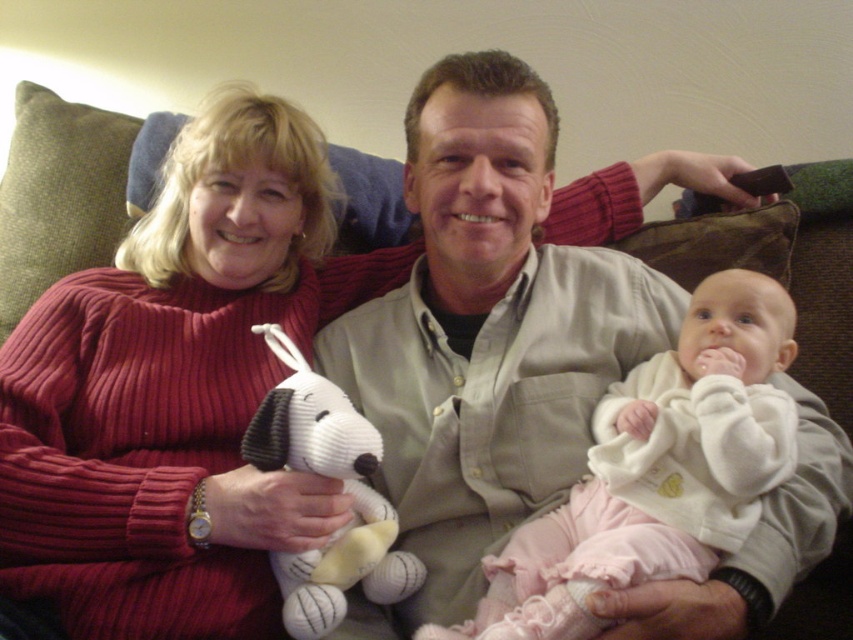
Question: Which point appears closest to the camera in this image?

Choices:
 (A) (368, 426)
 (B) (544, 371)

Answer: (A)

Question: Can you confirm if matte khaki shirt at center is positioned below white fleece jacket at center?

Choices:
 (A) yes
 (B) no

Answer: (B)

Question: Which object appears closest to the camera in this image?

Choices:
 (A) matte khaki shirt at center
 (B) white knitted dog at center
 (C) white fleece jacket at center

Answer: (A)

Question: Is matte khaki shirt at center positioned in front of white knitted dog at center?

Choices:
 (A) yes
 (B) no

Answer: (A)

Question: Can you confirm if matte khaki shirt at center is positioned to the right of white knitted dog at center?

Choices:
 (A) no
 (B) yes

Answer: (B)

Question: Which of the following is the closest to the observer?

Choices:
 (A) white fleece jacket at center
 (B) matte khaki shirt at center
 (C) white knitted dog at center

Answer: (B)